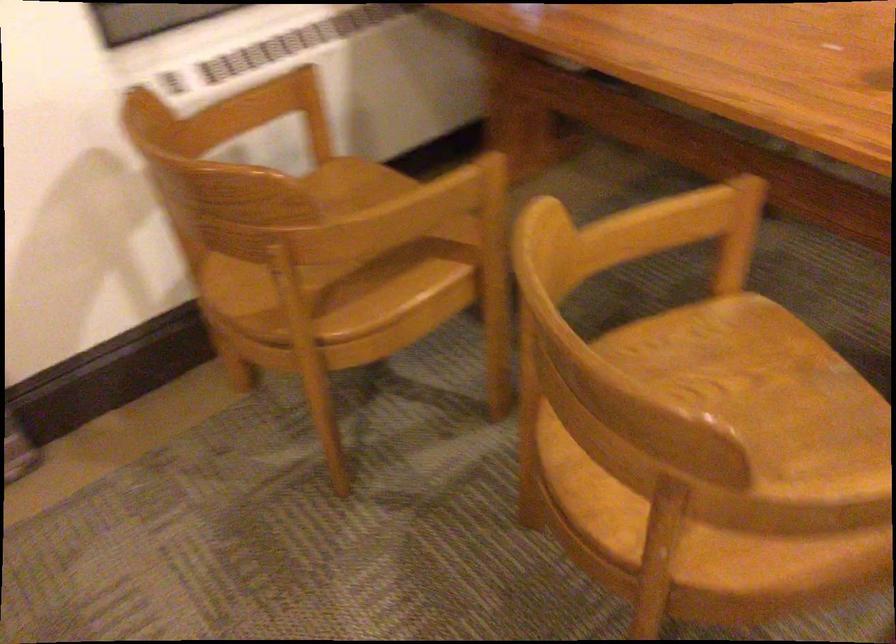
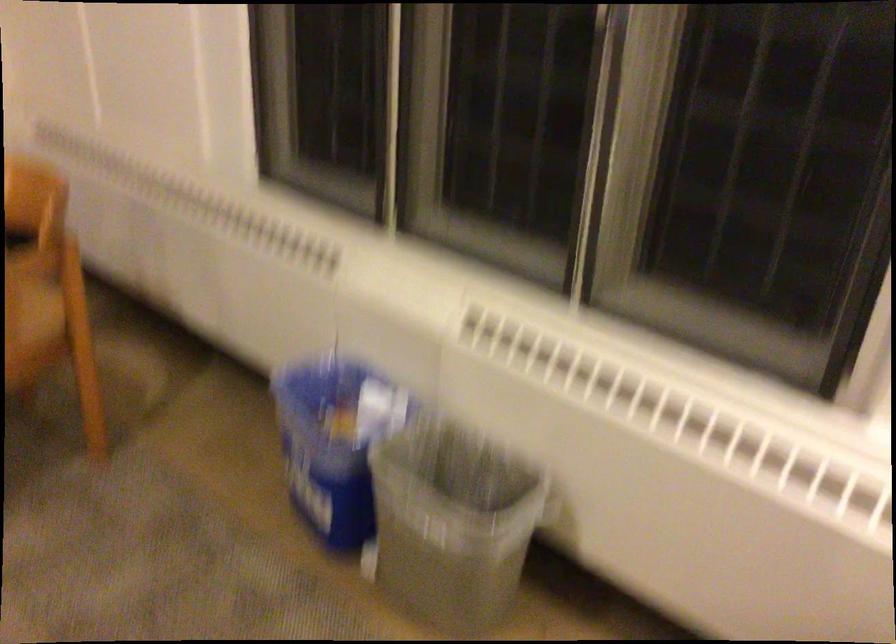
Question: In a continuous first-person perspective shot, in which direction is the camera moving?

Choices:
 (A) Left
 (B) Right
 (C) Forward
 (D) Backward

Answer: (B)